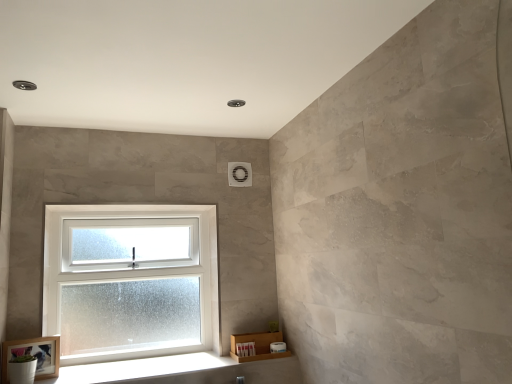
Identify the location of wooden frame at lower left. (34, 355).

The width and height of the screenshot is (512, 384). Identify the location of white wood at lower left. (182, 371).

Consider the image. Do you think white frosted glass window at lower left is within white wood at lower left, or outside of it?

white frosted glass window at lower left is outside white wood at lower left.

From the image's perspective, relative to white wood at lower left, is white frosted glass window at lower left above or below?

Based on their image positions, white frosted glass window at lower left is located above white wood at lower left.

This screenshot has height=384, width=512. Find the location of `window to the left of white wood at lower left`. window to the left of white wood at lower left is located at coordinates (127, 274).

Would you consider white wood at lower left to be distant from wooden frame at lower left?

No, white wood at lower left is in close proximity to wooden frame at lower left.

Between white wood at lower left and wooden frame at lower left, which one has larger width?

white wood at lower left is wider.

Is white frosted glass window at lower left inside white wood at lower left?

No, white wood at lower left does not contain white frosted glass window at lower left.

From the image's perspective, is white wood at lower left located beneath white frosted glass window at lower left?

Yes.

Is white wood at lower left positioned far away from white frosted glass window at lower left?

They are positioned close to each other.

At what (x,y) coordinates should I click in order to perform the action: click on window sill on the right side of white frosted glass window at lower left. Please return your answer as a coordinate pair (x, y). Looking at the image, I should click on click(182, 371).

Identify the location of picture frame above the white wood at lower left (from the image's perspective). The width and height of the screenshot is (512, 384). (34, 355).

Between wooden frame at lower left and white wood at lower left, which one appears on the right side from the viewer's perspective?

From the viewer's perspective, white wood at lower left appears more on the right side.

From the picture: Measure the distance from wooden frame at lower left to white wood at lower left.

46.42 centimeters.

Is white wood at lower left completely or partially inside wooden frame at lower left?

That's incorrect, white wood at lower left is not inside wooden frame at lower left.

What's the angular difference between wooden frame at lower left and white frosted glass window at lower left's facing directions?

18.7 degrees.

Is point (3, 353) closer or farther from the camera than point (116, 358)?

Clearly, point (3, 353) is closer to the camera than point (116, 358).

Is wooden frame at lower left with white frosted glass window at lower left?

wooden frame at lower left is not next to white frosted glass window at lower left, and they're not touching.

Between wooden frame at lower left and white frosted glass window at lower left, which one has larger size?

white frosted glass window at lower left.

From the image's perspective, is white frosted glass window at lower left below wooden frame at lower left?

→ No, from the image's perspective, white frosted glass window at lower left is not below wooden frame at lower left.

Can you see white frosted glass window at lower left touching wooden frame at lower left?

No, white frosted glass window at lower left is not beside wooden frame at lower left.

Considering the relative sizes of white frosted glass window at lower left and wooden frame at lower left in the image provided, is white frosted glass window at lower left wider than wooden frame at lower left?

Correct, the width of white frosted glass window at lower left exceeds that of wooden frame at lower left.

Find the location of a particular element. Image resolution: width=512 pixels, height=384 pixels. window located on the right of wooden frame at lower left is located at coordinates (127, 274).

This screenshot has width=512, height=384. I want to click on window that is on the left side of white wood at lower left, so click(x=127, y=274).

Locate an element on the screen. The width and height of the screenshot is (512, 384). window sill below the wooden frame at lower left (from the image's perspective) is located at coordinates (182, 371).

When comparing their distances from white wood at lower left, does wooden frame at lower left or white frosted glass window at lower left seem closer?

The object closer to white wood at lower left is white frosted glass window at lower left.

When comparing their distances from white frosted glass window at lower left, does wooden frame at lower left or white wood at lower left seem further?

Among the two, wooden frame at lower left is located further to white frosted glass window at lower left.

Considering their positions, is white frosted glass window at lower left positioned further to white wood at lower left than wooden frame at lower left?

The object further to white wood at lower left is wooden frame at lower left.

Which object lies further to the anchor point white frosted glass window at lower left, white wood at lower left or wooden frame at lower left?

wooden frame at lower left is positioned further to the anchor white frosted glass window at lower left.

Considering their positions, is white wood at lower left positioned further to wooden frame at lower left than white frosted glass window at lower left?

The object further to wooden frame at lower left is white frosted glass window at lower left.

From the image, which object appears to be farther from wooden frame at lower left, white frosted glass window at lower left or white wood at lower left?

Among the two, white frosted glass window at lower left is located further to wooden frame at lower left.

You are a GUI agent. You are given a task and a screenshot of the screen. Output one action in this format:
    pyautogui.click(x=<x>, y=<y>)
    Task: Click on the window between wooden frame at lower left and white wood at lower left from left to right
    Image resolution: width=512 pixels, height=384 pixels.
    Given the screenshot: What is the action you would take?
    pyautogui.click(x=127, y=274)